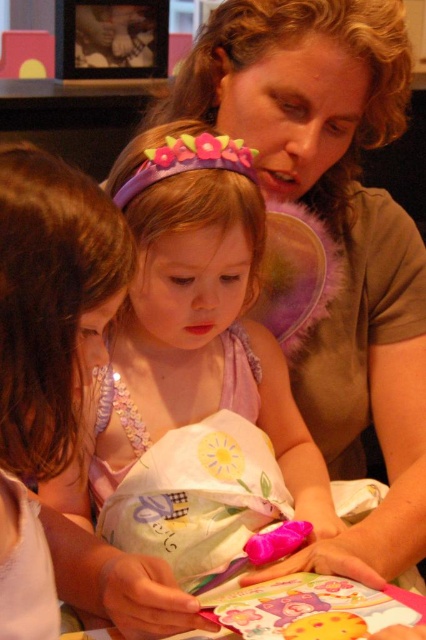
Question: Does pink satin dress at center appear on the left side of matte brown shirt at upper right?

Choices:
 (A) yes
 (B) no

Answer: (A)

Question: Can you confirm if pink satin dress at center is positioned above matte brown shirt at upper right?

Choices:
 (A) no
 (B) yes

Answer: (A)

Question: Which object is closer to the camera taking this photo?

Choices:
 (A) pink satin dress at center
 (B) matte brown shirt at upper right

Answer: (A)

Question: Which of the following is the closest to the observer?

Choices:
 (A) matte brown shirt at upper right
 (B) pink satin dress at center

Answer: (B)

Question: Does pink satin dress at center have a lesser width compared to matte brown shirt at upper right?

Choices:
 (A) yes
 (B) no

Answer: (A)